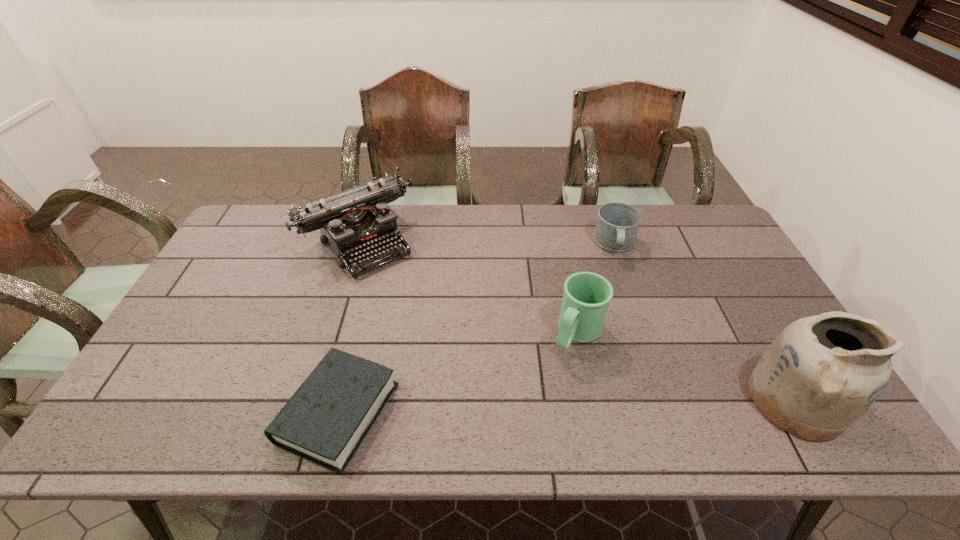
The height and width of the screenshot is (540, 960). I want to click on Bible positioned at the near edge, so click(x=325, y=421).

Find the location of a particular element. pottery that is at the near edge is located at coordinates (821, 373).

I want to click on object at the right edge, so click(x=821, y=373).

Where is `object at the near right corner`? object at the near right corner is located at coordinates (821, 373).

This screenshot has width=960, height=540. Find the location of `vacant space at the far edge of the desktop`. vacant space at the far edge of the desktop is located at coordinates (x=512, y=215).

You are a GUI agent. You are given a task and a screenshot of the screen. Output one action in this format:
    pyautogui.click(x=<x>, y=<y>)
    Task: Click on the blank area at the near edge
    This screenshot has width=960, height=540.
    Given the screenshot: What is the action you would take?
    pyautogui.click(x=476, y=373)

At what (x,y) coordinates should I click in order to perform the action: click on blank space at the left edge. Please return your answer as a coordinate pair (x, y). This screenshot has width=960, height=540. Looking at the image, I should click on (211, 311).

At what (x,y) coordinates should I click in order to perform the action: click on vacant space at the right edge of the desktop. Please return your answer as a coordinate pair (x, y). This screenshot has height=540, width=960. Looking at the image, I should click on (737, 346).

The height and width of the screenshot is (540, 960). I want to click on free region at the near left corner of the desktop, so [200, 400].

The width and height of the screenshot is (960, 540). I want to click on vacant space in between the third nearest object and the rightmost object, so click(685, 366).